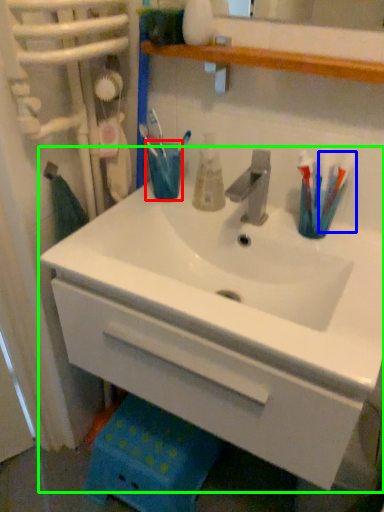
Question: Based on their relative distances, which object is farther from turquoise (highlighted by a red box)? Choose from toothbrush (highlighted by a blue box) and sink (highlighted by a green box).

Choices:
 (A) toothbrush
 (B) sink

Answer: (A)